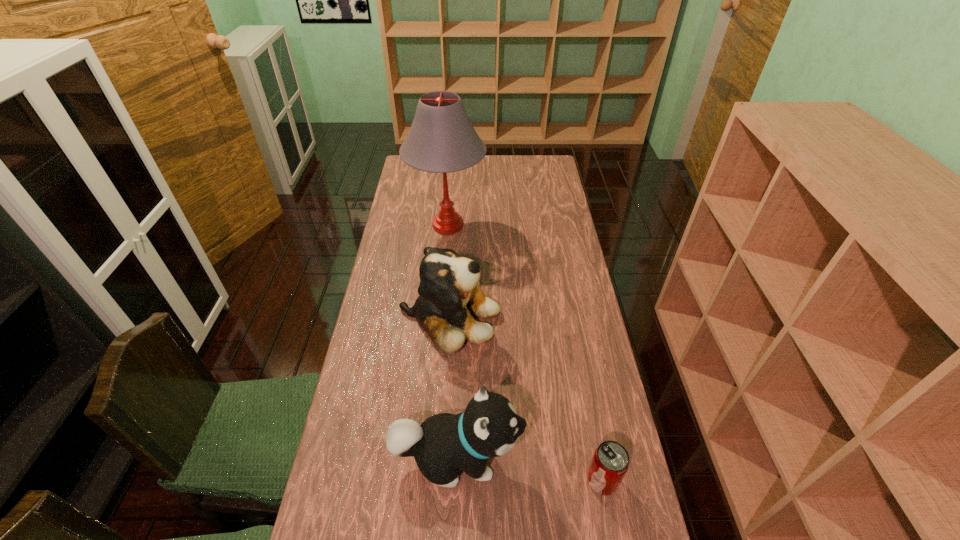
Where is `unoccupied area between the shortest object and the third nearest object`? The image size is (960, 540). unoccupied area between the shortest object and the third nearest object is located at coordinates pos(526,399).

Where is `vacant point located between the third nearest object and the nearer puppy`? This screenshot has height=540, width=960. vacant point located between the third nearest object and the nearer puppy is located at coordinates (453, 388).

Identify the location of free space between the shortest object and the farthest object. The image size is (960, 540). (525, 353).

I want to click on object that is the third closest one to the third nearest object, so click(610, 462).

Where is `object that stands as the closest to the farthest object`? object that stands as the closest to the farthest object is located at coordinates (449, 290).

Identify the location of free space that satisfies the following two spatial constraints: 1. at the face of the third nearest object; 2. on the left side of the rightmost object. The image size is (960, 540). (439, 480).

I want to click on free space that satisfies the following two spatial constraints: 1. at the face of the nearer puppy; 2. on the left side of the pop soda, so click(x=456, y=480).

At what (x,y) coordinates should I click in order to perform the action: click on vacant space that satisfies the following two spatial constraints: 1. on the front-facing side of the table lamp; 2. on the left side of the rightmost object. Please return your answer as a coordinate pair (x, y). Looking at the image, I should click on (426, 480).

What are the coordinates of `vacant region that satisfies the following two spatial constraints: 1. on the back side of the shortest object; 2. at the face of the nearer puppy` in the screenshot? It's located at (598, 457).

You are a GUI agent. You are given a task and a screenshot of the screen. Output one action in this format:
    pyautogui.click(x=<x>, y=<y>)
    Task: Click on the vacant space that satisfies the following two spatial constraints: 1. at the face of the third nearest object; 2. on the left side of the rightmost object
    
    Given the screenshot: What is the action you would take?
    pyautogui.click(x=439, y=480)